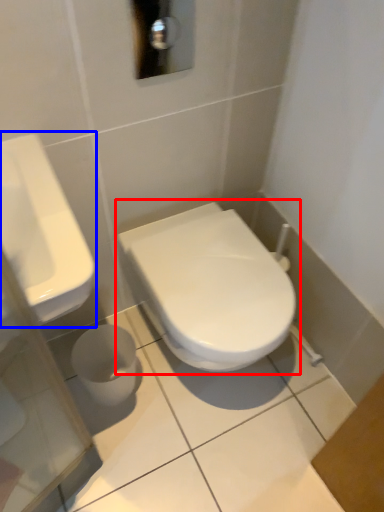
Question: Which object appears farthest to the camera in this image, toilet (highlighted by a red box) or sink (highlighted by a blue box)?

Choices:
 (A) toilet
 (B) sink

Answer: (A)